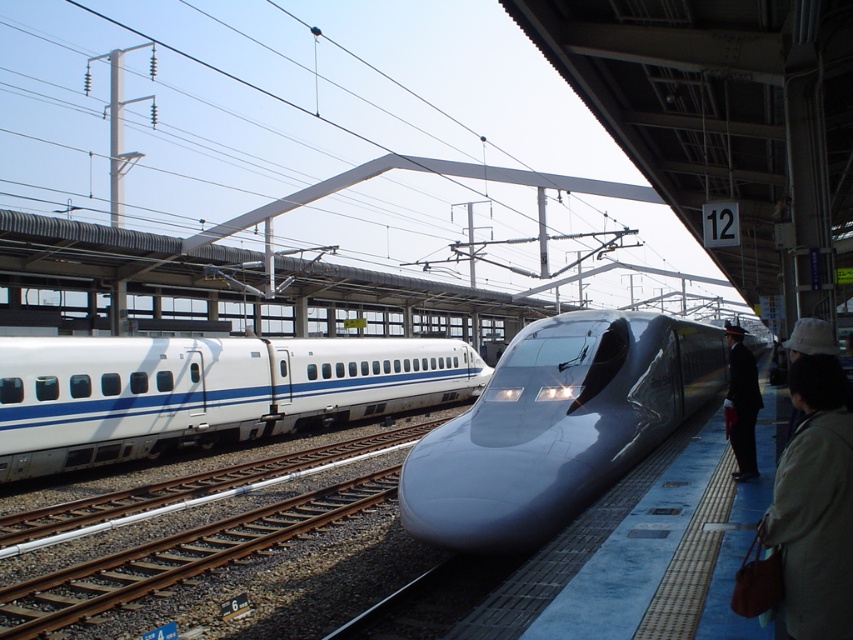
Does white glossy train at center lie in front of beige fabric coat at lower right?

No, it is not.

Which of these two, white glossy train at center or beige fabric coat at lower right, stands taller?

Standing taller between the two is white glossy train at center.

Measure the distance between point (x=154, y=396) and camera.

A distance of 56.53 feet exists between point (x=154, y=396) and camera.

You are a GUI agent. You are given a task and a screenshot of the screen. Output one action in this format:
    pyautogui.click(x=<x>, y=<y>)
    Task: Click on the white glossy train at center
    
    Given the screenshot: What is the action you would take?
    pyautogui.click(x=206, y=392)

Is glossy metallic train at center wider than dark suit at platform right?

Correct, the width of glossy metallic train at center exceeds that of dark suit at platform right.

Locate an element on the screen. Image resolution: width=853 pixels, height=640 pixels. glossy metallic train at center is located at coordinates (556, 426).

Who is more distant from viewer, (526, 413) or (740, 390)?

Point (526, 413)

What are the coordinates of `glossy metallic train at center` in the screenshot? It's located at (556, 426).

The height and width of the screenshot is (640, 853). What do you see at coordinates (556, 426) in the screenshot? I see `glossy metallic train at center` at bounding box center [556, 426].

Looking at this image, can you confirm if glossy metallic train at center is taller than white glossy train at center?

Yes, glossy metallic train at center is taller than white glossy train at center.

Between point (672, 323) and point (241, 416), which one is positioned behind?

The point (241, 416) is more distant.

Identify the location of glossy metallic train at center. (556, 426).